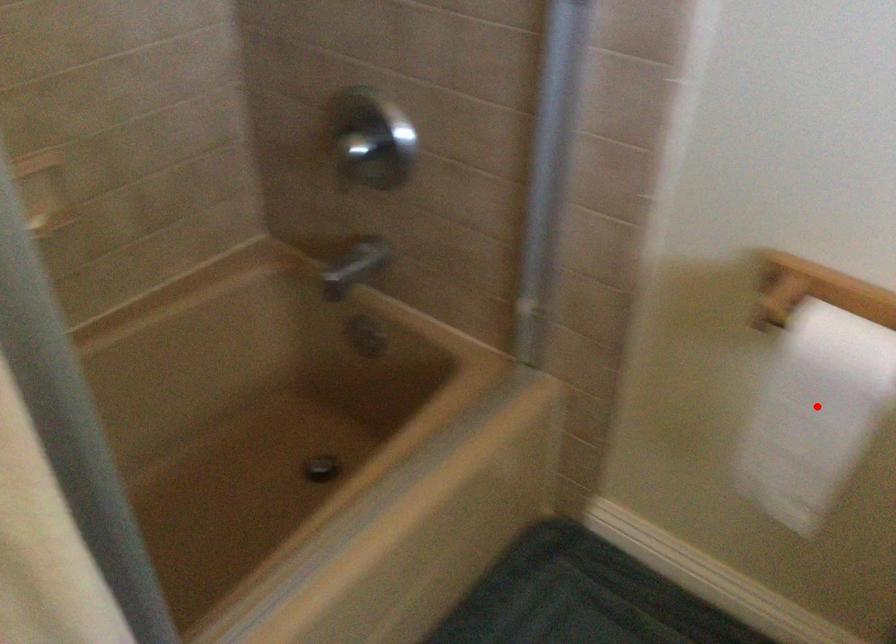
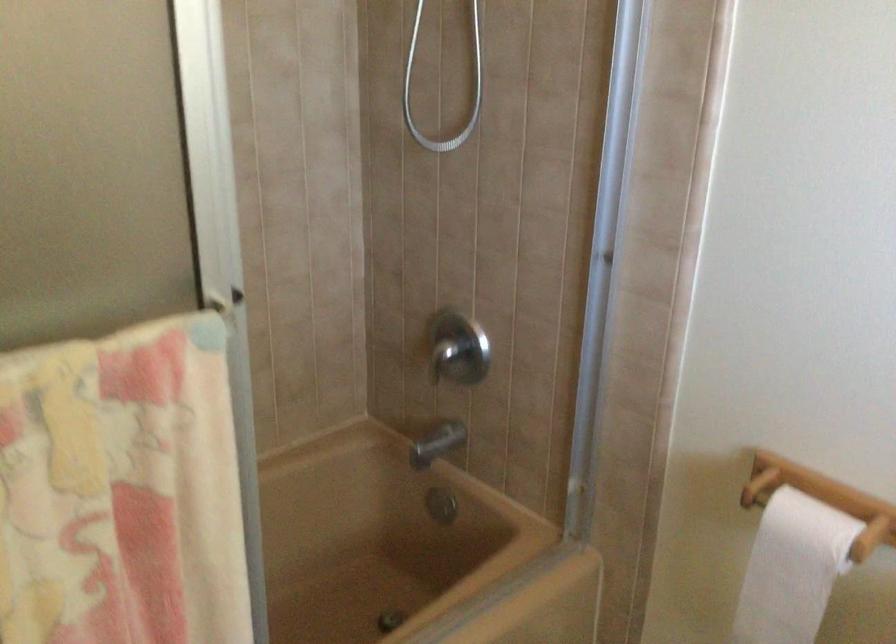
The point at the highlighted location is marked in the first image. Where is the corresponding point in the second image?

(791, 569)